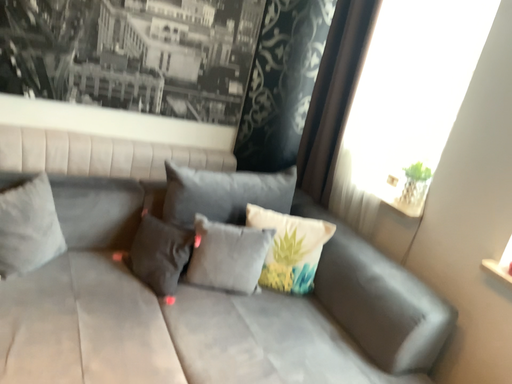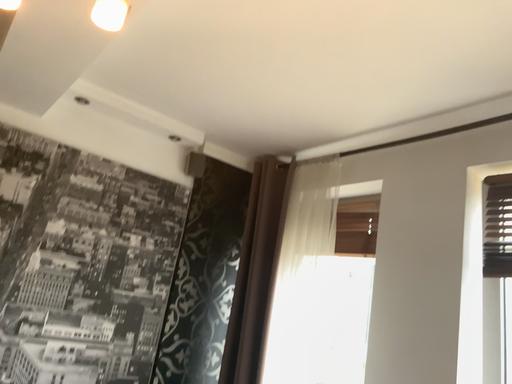
Question: How did the camera likely rotate when shooting the video?

Choices:
 (A) rotated right
 (B) rotated left

Answer: (A)